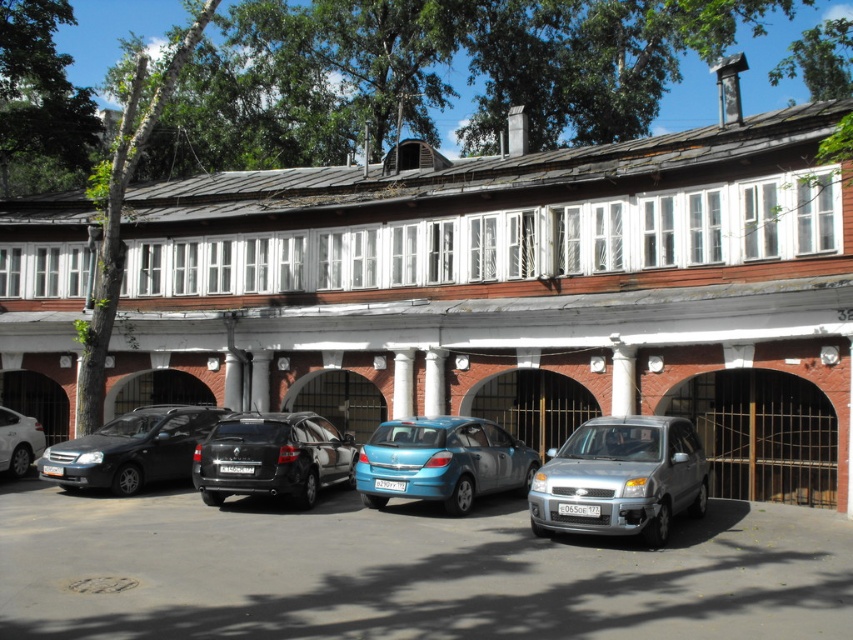
Question: Estimate the real-world distances between objects in this image. Which object is farther from the white marble column at center?

Choices:
 (A) silver metallic hatchback at center
 (B) shiny silver sedan at left

Answer: (A)

Question: Is brown wooden building at center to the right of shiny silver sedan at left from the viewer's perspective?

Choices:
 (A) no
 (B) yes

Answer: (B)

Question: Is blue metallic hatchback at center in front of shiny silver sedan at left?

Choices:
 (A) no
 (B) yes

Answer: (B)

Question: Does silver metallic hatchback at center have a smaller size compared to shiny silver sedan at left?

Choices:
 (A) yes
 (B) no

Answer: (B)

Question: Estimate the real-world distances between objects in this image. Which object is farther from the shiny silver sedan at left?

Choices:
 (A) brown wooden building at center
 (B) white marble column at center
 (C) silver metallic hatchback at center
 (D) shiny black sedan at center

Answer: (C)

Question: Which of these objects is positioned closest to the shiny black sedan at center?

Choices:
 (A) brown wooden building at center
 (B) white marble column at center
 (C) blue metallic hatchback at center

Answer: (B)